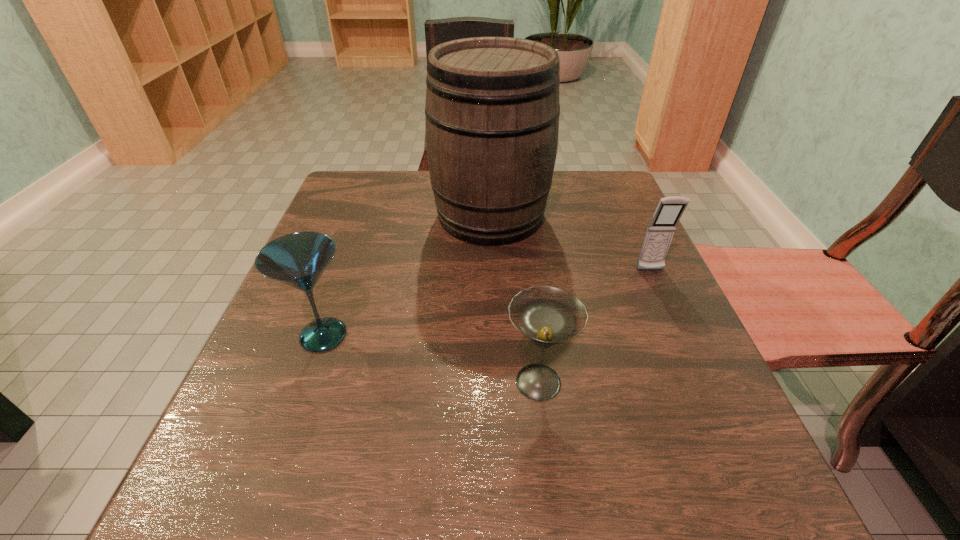
The width and height of the screenshot is (960, 540). What are the coordinates of `object at the far edge` in the screenshot? It's located at (492, 110).

At what (x,y) coordinates should I click in order to perform the action: click on object that is at the left edge. Please return your answer as a coordinate pair (x, y). The width and height of the screenshot is (960, 540). Looking at the image, I should click on (298, 259).

You are a GUI agent. You are given a task and a screenshot of the screen. Output one action in this format:
    pyautogui.click(x=<x>, y=<y>)
    Task: Click on the object situated at the right edge
    This screenshot has width=960, height=540.
    Given the screenshot: What is the action you would take?
    pyautogui.click(x=660, y=231)

At what (x,y) coordinates should I click in order to perform the action: click on free space at the far edge. Please return your answer as a coordinate pair (x, y). The image size is (960, 540). Looking at the image, I should click on (422, 174).

This screenshot has height=540, width=960. In the image, there is a desktop. What are the coordinates of `vacant space at the left edge` in the screenshot? It's located at (382, 252).

This screenshot has width=960, height=540. In order to click on free region at the right edge of the desktop in this screenshot , I will do `click(673, 454)`.

Identify the location of vacant region at the far left corner of the desktop. Image resolution: width=960 pixels, height=540 pixels. (385, 173).

In the image, there is a desktop. Where is `free space at the near left corner`? The width and height of the screenshot is (960, 540). free space at the near left corner is located at coordinates click(x=263, y=518).

Where is `free space at the far right corner of the desktop`? The image size is (960, 540). free space at the far right corner of the desktop is located at coordinates (583, 184).

In the image, there is a desktop. Find the location of `vacant space at the near right corner`. vacant space at the near right corner is located at coordinates (756, 500).